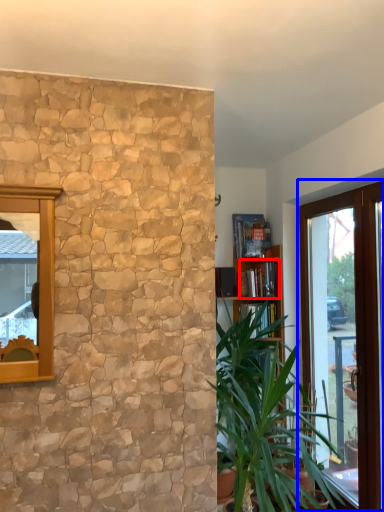
Question: Which object appears farthest to the camera in this image, book (highlighted by a red box) or window (highlighted by a blue box)?

Choices:
 (A) book
 (B) window

Answer: (A)